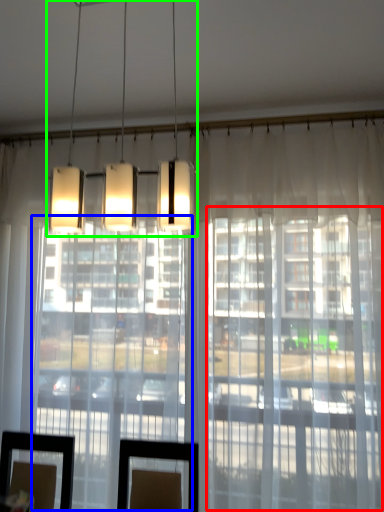
Question: Which object is the farthest from glass door (highlighted by a red box)? Choose among these: glass door (highlighted by a blue box) or lamp (highlighted by a green box).

Choices:
 (A) glass door
 (B) lamp

Answer: (B)